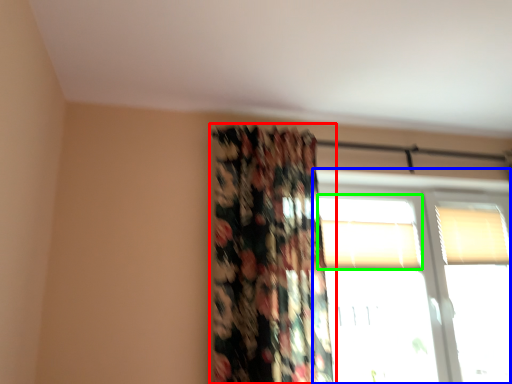
Question: Considering the real-world distances, which object is farthest from curtain (highlighted by a red box)? window (highlighted by a blue box) or window (highlighted by a green box)?

Choices:
 (A) window
 (B) window

Answer: (A)